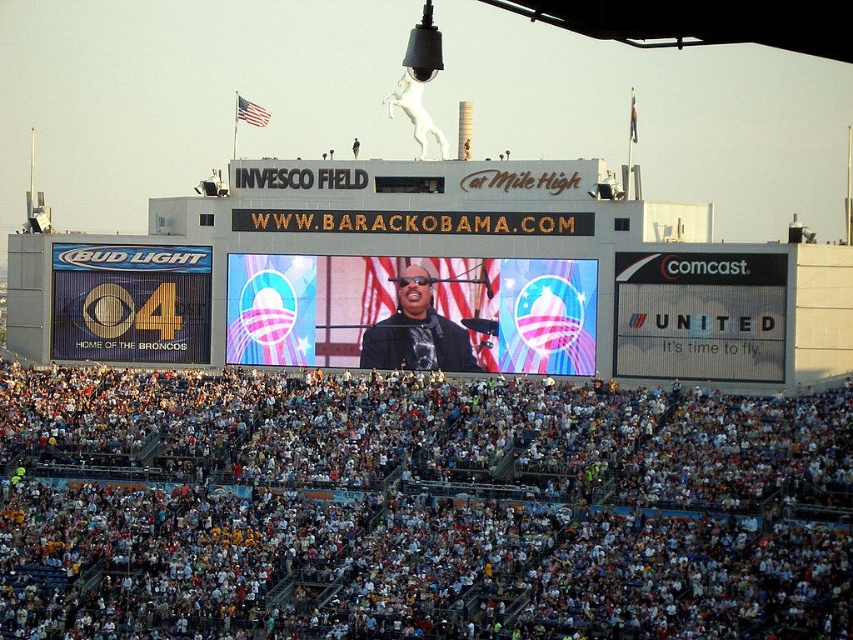
You are a photographer at Invesco Field at Mile High and want to capture a photo that includes both the white cotton crowd at lower center and the matte black jacket at center. Based on their positions, which object should you focus on first to ensure both are in the frame?

The white cotton crowd at lower center is located below the matte black jacket at center, so you should focus on the matte black jacket at center first to ensure both are in the frame.

You are a photographer at Invesco Field and want to capture both the shiny digital display at center and the matte black jacket at center in a single photo. Given their sizes, which object should you focus on first to ensure both are in frame?

The shiny digital display at center is larger than the matte black jacket at center, so you should focus on the shiny digital display at center first to ensure both fit within the frame.